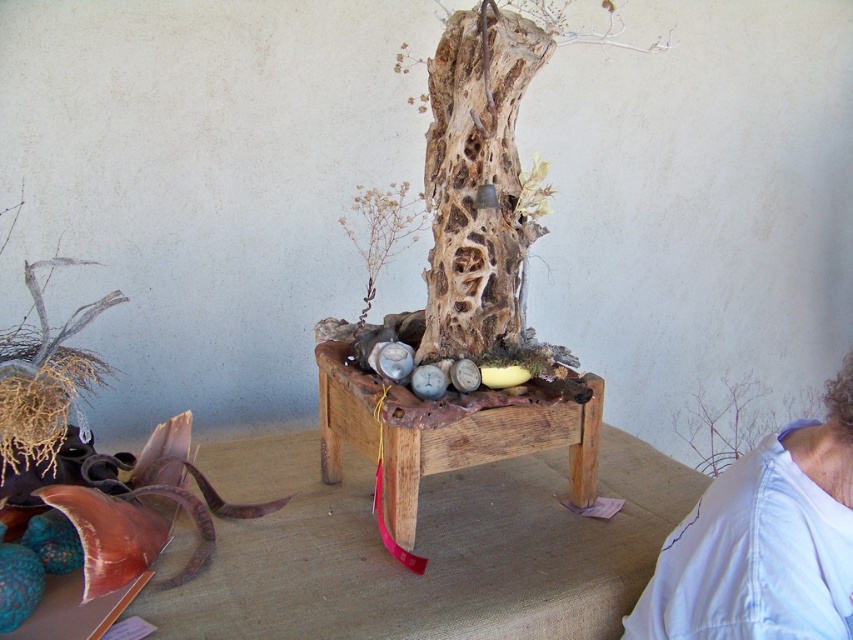
Can you confirm if natural wood tree trunk at center is positioned to the right of wooden table at center?

Indeed, natural wood tree trunk at center is positioned on the right side of wooden table at center.

Which is in front, point (430, 65) or point (329, 476)?

Point (430, 65) is more forward.

Identify the location of natural wood tree trunk at center. This screenshot has height=640, width=853. (476, 179).

This screenshot has width=853, height=640. I want to click on natural wood tree trunk at center, so click(x=476, y=179).

Between light blue fabric at upper right and wooden table at center, which one has more height?

light blue fabric at upper right is taller.

Does light blue fabric at upper right appear under wooden table at center?

Indeed, light blue fabric at upper right is positioned under wooden table at center.

Image resolution: width=853 pixels, height=640 pixels. I want to click on light blue fabric at upper right, so click(764, 541).

Consider the image. Which is below, light blue fabric at upper right or natural wood tree trunk at center?

light blue fabric at upper right is below.

Who is positioned more to the right, light blue fabric at upper right or natural wood tree trunk at center?

From the viewer's perspective, light blue fabric at upper right appears more on the right side.

Which is in front, point (759, 470) or point (508, 72)?

Point (759, 470) is more forward.

Identify the location of light blue fabric at upper right. (764, 541).